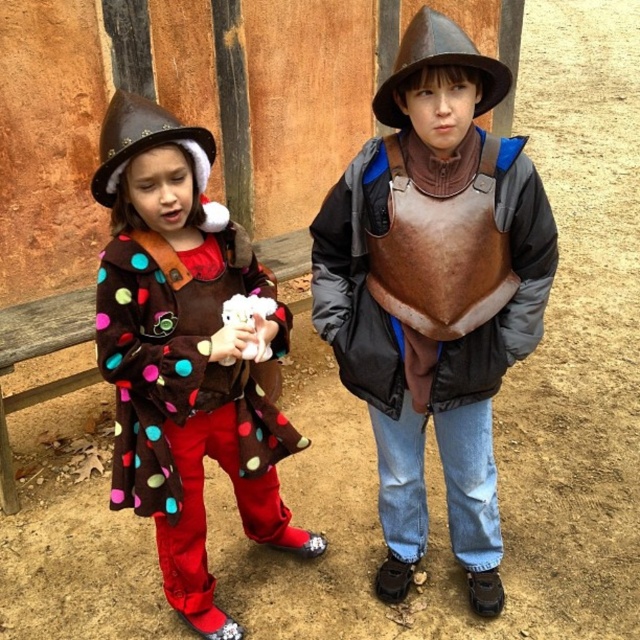
You are a costume designer observing the two children in the rustic setting. You need to determine the spatial arrangement of their costumes. Which costume piece is positioned lower between the brown leather armor at center and the brown leather hat at upper center?

The brown leather armor at center is positioned lower than the brown leather hat at upper center, as it is located below it.

You are a costume designer observing the two children in the rustic setting. You need to determine the spatial relationship between the brown leather armor at center and the polka dot fleece coat at center. Which one is positioned higher?

The brown leather armor at center is positioned higher than the polka dot fleece coat at center.